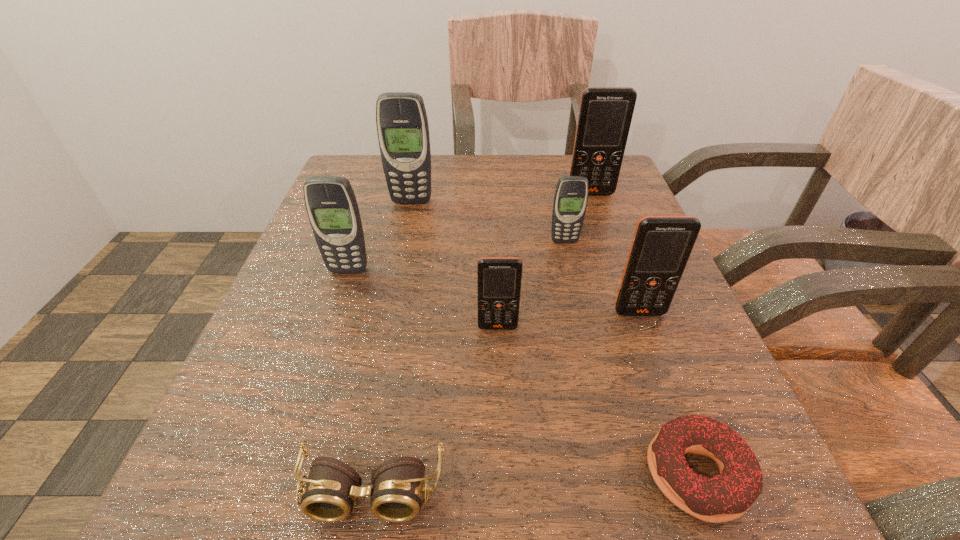
This screenshot has height=540, width=960. What are the coordinates of `the fourth nearest cellular telephone` in the screenshot? It's located at (571, 195).

The image size is (960, 540). Identify the location of the smallest gray cellular telephone. coord(571,195).

This screenshot has height=540, width=960. Find the location of `goggles`. goggles is located at coordinates (329, 495).

Where is `brown goggles`? The width and height of the screenshot is (960, 540). brown goggles is located at coordinates (329, 495).

You are a GUI agent. You are given a task and a screenshot of the screen. Output one action in this format:
    pyautogui.click(x=<x>, y=<y>)
    Task: Click on the doughnut
    
    Given the screenshot: What is the action you would take?
    pyautogui.click(x=726, y=496)

Locate an element on the screen. Image resolution: width=960 pixels, height=540 pixels. chocolate doughnut is located at coordinates 726,496.

The width and height of the screenshot is (960, 540). Identify the location of free location located on the screen of the farthest object. (600, 221).

The image size is (960, 540). Find the location of `free space located 0.290m on the screen of the biggest gray cellular telephone`. free space located 0.290m on the screen of the biggest gray cellular telephone is located at coordinates (390, 303).

At what (x,y) coordinates should I click in order to perform the action: click on vacant space located on the screen of the fifth nearest object. Please return your answer as a coordinate pair (x, y). This screenshot has height=540, width=960. Looking at the image, I should click on (304, 401).

The image size is (960, 540). I want to click on free location located 0.170m on the screen of the fourth nearest object, so click(678, 416).